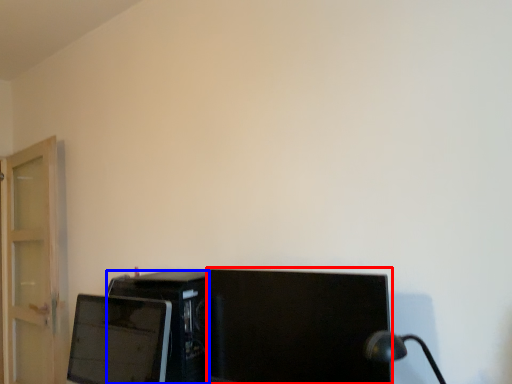
Question: Which object is further to the camera taking this photo, computer monitor (highlighted by a red box) or desktop computer (highlighted by a blue box)?

Choices:
 (A) computer monitor
 (B) desktop computer

Answer: (B)